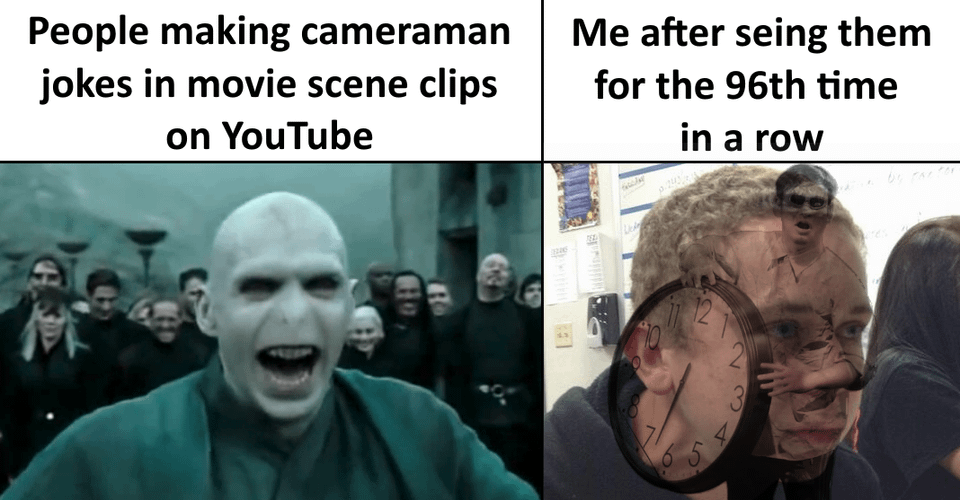
Locate an element on the screen. clock is located at coordinates (707, 366).